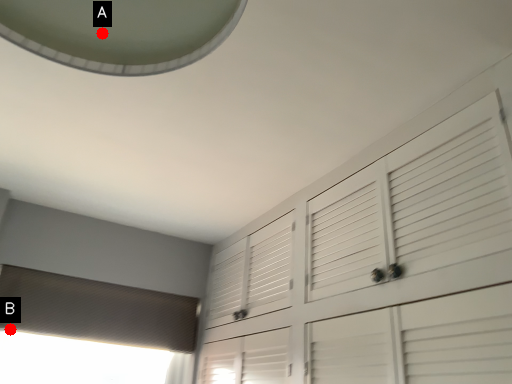
Question: Two points are circled on the image, labeled by A and B beside each circle. Among these points, which one is nearest to the camera?

Choices:
 (A) A is closer
 (B) B is closer

Answer: (A)